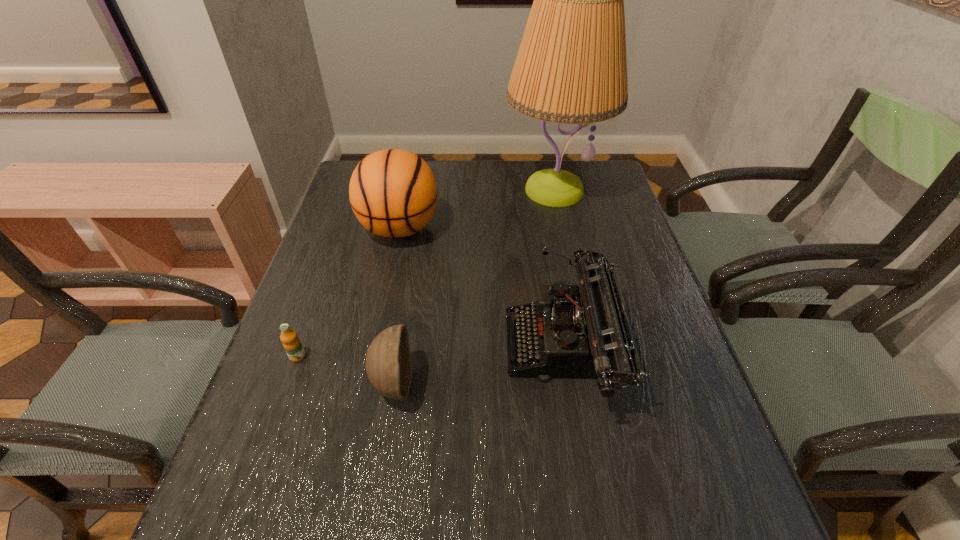
This screenshot has width=960, height=540. In order to click on free space at the left edge of the desktop in this screenshot , I will do `click(286, 362)`.

This screenshot has height=540, width=960. In the image, there is a desktop. In order to click on vacant space at the right edge in this screenshot , I will do `click(651, 461)`.

What are the coordinates of `vacant space at the far right corner of the desktop` in the screenshot? It's located at (602, 170).

At what (x,y) coordinates should I click in order to perform the action: click on free spot between the bowl and the leftmost object. Please return your answer as a coordinate pair (x, y). The height and width of the screenshot is (540, 960). Looking at the image, I should click on (346, 370).

Where is `blank region between the bowl and the tallest object`? The height and width of the screenshot is (540, 960). blank region between the bowl and the tallest object is located at coordinates (473, 287).

The width and height of the screenshot is (960, 540). Find the location of `vacant point located between the tallest object and the typewriter`. vacant point located between the tallest object and the typewriter is located at coordinates (559, 269).

Locate an element on the screen. The width and height of the screenshot is (960, 540). vacant space that's between the basketball and the typewriter is located at coordinates (482, 288).

Image resolution: width=960 pixels, height=540 pixels. I want to click on vacant region between the orange juice and the typewriter, so click(431, 352).

I want to click on unoccupied area between the fourth shortest object and the bowl, so click(396, 306).

What are the coordinates of `empty location between the basketball and the tallest object` in the screenshot? It's located at (476, 210).